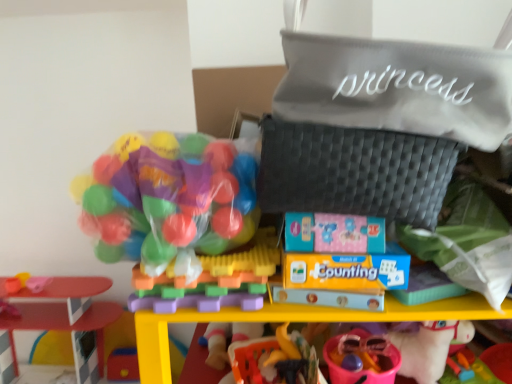
What do you see at coordinates (212, 281) in the screenshot?
I see `translucent plastic balls at center, the 3th toy positioned from the left` at bounding box center [212, 281].

Where is `translucent plastic balls at center, acting as the third toy starting from the right`? This screenshot has width=512, height=384. translucent plastic balls at center, acting as the third toy starting from the right is located at coordinates (212, 281).

What do you see at coordinates (168, 201) in the screenshot?
I see `translucent plastic balls at upper left, which ranks as the 2th toy in left-to-right order` at bounding box center [168, 201].

Where is `rubber duck at lower center, which appears as the second toy when viewed from the right`? The image size is (512, 384). rubber duck at lower center, which appears as the second toy when viewed from the right is located at coordinates (272, 358).

Looking at this image, does translucent plastic balls at upper left, which ranks as the 2th toy in left-to-right order, have a greater height compared to smooth plastic table at left, acting as the fifth toy starting from the right?

No.

The height and width of the screenshot is (384, 512). I want to click on the 4th toy positioned above the smooth plastic table at left, which is counted as the first toy, starting from the left (from the image's perspective), so 168,201.

Is the depth of translucent plastic balls at upper left, which ranks as the 2th toy in left-to-right order, less than that of smooth plastic table at left, acting as the fifth toy starting from the right?

Yes, the depth of translucent plastic balls at upper left, which ranks as the 2th toy in left-to-right order, is less than that of smooth plastic table at left, acting as the fifth toy starting from the right.

Is translucent plastic balls at upper left, which ranks as the 2th toy in left-to-right order, far away from smooth plastic table at left, which is counted as the first toy, starting from the left?

translucent plastic balls at upper left, which ranks as the 2th toy in left-to-right order, is far away from smooth plastic table at left, which is counted as the first toy, starting from the left.

Is smooth plastic table at left, which is counted as the first toy, starting from the left, placed right next to rubber duck at lower center, which appears as the second toy when viewed from the right?

smooth plastic table at left, which is counted as the first toy, starting from the left, is not next to rubber duck at lower center, which appears as the second toy when viewed from the right, and they're not touching.

Is smooth plastic table at left, acting as the fifth toy starting from the right, shorter than rubber duck at lower center, which appears as the second toy when viewed from the right?

No, smooth plastic table at left, acting as the fifth toy starting from the right, is not shorter than rubber duck at lower center, which appears as the second toy when viewed from the right.

The height and width of the screenshot is (384, 512). Identify the location of toy below the rubber duck at lower center, acting as the 4th toy starting from the left (from a real-world perspective). pyautogui.click(x=61, y=322).

Is translucent plastic balls at center, the 3th toy positioned from the left, oriented towards smooth plastic table at left, acting as the fifth toy starting from the right?

No, translucent plastic balls at center, the 3th toy positioned from the left, is not aimed at smooth plastic table at left, acting as the fifth toy starting from the right.

Find the location of a particular element. Image resolution: width=512 pixels, height=384 pixels. the 3rd toy positioned below the translucent plastic balls at center, acting as the third toy starting from the right (from a real-world perspective) is located at coordinates (61, 322).

From the image's perspective, is translucent plastic balls at center, acting as the third toy starting from the right, under smooth plastic table at left, which is counted as the first toy, starting from the left?

No, from the image's perspective, translucent plastic balls at center, acting as the third toy starting from the right, is not beneath smooth plastic table at left, which is counted as the first toy, starting from the left.

Is translucent plastic balls at center, acting as the third toy starting from the right, further to the viewer compared to smooth plastic table at left, acting as the fifth toy starting from the right?

No, translucent plastic balls at center, acting as the third toy starting from the right, is closer to the viewer.

Is pink plastic bucket at lower center, the 1th toy viewed from the right, behind smooth plastic table at left, which is counted as the first toy, starting from the left?

No, pink plastic bucket at lower center, the 1th toy viewed from the right, is in front of smooth plastic table at left, which is counted as the first toy, starting from the left.

Who is shorter, pink plastic bucket at lower center, the 1th toy viewed from the right, or smooth plastic table at left, which is counted as the first toy, starting from the left?

pink plastic bucket at lower center, the 1th toy viewed from the right, is shorter.

Is pink plastic bucket at lower center, the 1th toy viewed from the right, looking in the opposite direction of smooth plastic table at left, which is counted as the first toy, starting from the left?

pink plastic bucket at lower center, the 1th toy viewed from the right, does not have its back to smooth plastic table at left, which is counted as the first toy, starting from the left.

Considering the sizes of objects pink plastic bucket at lower center, the 5th toy viewed from the left, and smooth plastic table at left, which is counted as the first toy, starting from the left, in the image provided, who is thinner, pink plastic bucket at lower center, the 5th toy viewed from the left, or smooth plastic table at left, which is counted as the first toy, starting from the left,?

With smaller width is pink plastic bucket at lower center, the 5th toy viewed from the left.

How different are the orientations of translucent plastic balls at center, the 3th toy positioned from the left, and pink plastic bucket at lower center, the 1th toy viewed from the right, in degrees?

0.00245 degrees.

This screenshot has height=384, width=512. I want to click on the 1st toy positioned below the translucent plastic balls at center, acting as the third toy starting from the right (from a real-world perspective), so click(x=362, y=360).

Is translucent plastic balls at center, the 3th toy positioned from the left, positioned with its back to pink plastic bucket at lower center, the 5th toy viewed from the left?

No, translucent plastic balls at center, the 3th toy positioned from the left,'s orientation is not away from pink plastic bucket at lower center, the 5th toy viewed from the left.

Is translucent plastic balls at center, acting as the third toy starting from the right, to the left of pink plastic bucket at lower center, the 5th toy viewed from the left, from the viewer's perspective?

Yes.

Relative to translucent plastic balls at center, acting as the third toy starting from the right, is rubber duck at lower center, acting as the 4th toy starting from the left, in front or behind?

Clearly, rubber duck at lower center, acting as the 4th toy starting from the left, is behind translucent plastic balls at center, acting as the third toy starting from the right.

Which point is more distant from viewer, (257, 349) or (188, 296)?

Positioned behind is point (257, 349).

Is rubber duck at lower center, which appears as the second toy when viewed from the right, next to translucent plastic balls at center, acting as the third toy starting from the right?

rubber duck at lower center, which appears as the second toy when viewed from the right, is not next to translucent plastic balls at center, acting as the third toy starting from the right, and they're not touching.

Can you confirm if rubber duck at lower center, acting as the 4th toy starting from the left, is shorter than translucent plastic balls at center, the 3th toy positioned from the left?

Incorrect, the height of rubber duck at lower center, acting as the 4th toy starting from the left, does not fall short of that of translucent plastic balls at center, the 3th toy positioned from the left.

Considering the relative sizes of translucent plastic balls at upper left, which is the 4th toy in right-to-left order, and translucent plastic balls at center, acting as the third toy starting from the right, in the image provided, is translucent plastic balls at upper left, which is the 4th toy in right-to-left order, bigger than translucent plastic balls at center, acting as the third toy starting from the right,?

Yes, translucent plastic balls at upper left, which is the 4th toy in right-to-left order, is bigger than translucent plastic balls at center, acting as the third toy starting from the right.

Is translucent plastic balls at upper left, which is the 4th toy in right-to-left order, spatially inside translucent plastic balls at center, acting as the third toy starting from the right, or outside of it?

translucent plastic balls at upper left, which is the 4th toy in right-to-left order, lies outside translucent plastic balls at center, acting as the third toy starting from the right.

Which of these two, translucent plastic balls at upper left, which is the 4th toy in right-to-left order, or translucent plastic balls at center, acting as the third toy starting from the right, is thinner?

translucent plastic balls at upper left, which is the 4th toy in right-to-left order.

Is there a large distance between translucent plastic balls at upper left, which is the 4th toy in right-to-left order, and translucent plastic balls at center, the 3th toy positioned from the left?

They are positioned close to each other.

This screenshot has height=384, width=512. Find the location of `toy that is the 4th object above the smooth plastic table at left, acting as the fifth toy starting from the right (from a real-world perspective)`. toy that is the 4th object above the smooth plastic table at left, acting as the fifth toy starting from the right (from a real-world perspective) is located at coordinates (168, 201).

From the rubber duck at lower center, acting as the 4th toy starting from the left, count the 3rd toy to the left and point to it. Please provide its 2D coordinates.

[(61, 322)]

Considering their positions, is rubber duck at lower center, which appears as the second toy when viewed from the right, positioned further to translucent plastic balls at upper left, which ranks as the 2th toy in left-to-right order, than pink plastic bucket at lower center, the 1th toy viewed from the right?

Among the two, pink plastic bucket at lower center, the 1th toy viewed from the right, is located further to translucent plastic balls at upper left, which ranks as the 2th toy in left-to-right order.

Which object lies nearer to the anchor point smooth plastic table at left, acting as the fifth toy starting from the right, pink plastic bucket at lower center, the 5th toy viewed from the left, or rubber duck at lower center, which appears as the second toy when viewed from the right?

rubber duck at lower center, which appears as the second toy when viewed from the right.

Considering their positions, is smooth plastic table at left, which is counted as the first toy, starting from the left, positioned closer to translucent plastic balls at center, the 3th toy positioned from the left, than rubber duck at lower center, acting as the 4th toy starting from the left?

The object closer to translucent plastic balls at center, the 3th toy positioned from the left, is rubber duck at lower center, acting as the 4th toy starting from the left.

From the image, which object appears to be nearer to translucent plastic balls at upper left, which is the 4th toy in right-to-left order, pink plastic bucket at lower center, the 5th toy viewed from the left, or smooth plastic table at left, which is counted as the first toy, starting from the left?

Based on the image, pink plastic bucket at lower center, the 5th toy viewed from the left, appears to be nearer to translucent plastic balls at upper left, which is the 4th toy in right-to-left order.

Looking at the image, which one is located closer to smooth plastic table at left, which is counted as the first toy, starting from the left, translucent plastic balls at center, the 3th toy positioned from the left, or rubber duck at lower center, acting as the 4th toy starting from the left?

rubber duck at lower center, acting as the 4th toy starting from the left, is closer to smooth plastic table at left, which is counted as the first toy, starting from the left.

When comparing their distances from pink plastic bucket at lower center, the 1th toy viewed from the right, does translucent plastic balls at upper left, which is the 4th toy in right-to-left order, or rubber duck at lower center, acting as the 4th toy starting from the left, seem closer?

Based on the image, rubber duck at lower center, acting as the 4th toy starting from the left, appears to be nearer to pink plastic bucket at lower center, the 1th toy viewed from the right.

When comparing their distances from translucent plastic balls at center, acting as the third toy starting from the right, does translucent plastic balls at upper left, which is the 4th toy in right-to-left order, or pink plastic bucket at lower center, the 5th toy viewed from the left, seem closer?

Based on the image, translucent plastic balls at upper left, which is the 4th toy in right-to-left order, appears to be nearer to translucent plastic balls at center, acting as the third toy starting from the right.

Estimate the real-world distances between objects in this image. Which object is closer to pink plastic bucket at lower center, the 5th toy viewed from the left, translucent plastic balls at upper left, which is the 4th toy in right-to-left order, or smooth plastic table at left, which is counted as the first toy, starting from the left?

translucent plastic balls at upper left, which is the 4th toy in right-to-left order, lies closer to pink plastic bucket at lower center, the 5th toy viewed from the left, than the other object.

You are a GUI agent. You are given a task and a screenshot of the screen. Output one action in this format:
    pyautogui.click(x=<x>, y=<y>)
    Task: Click on the toy between translucent plastic balls at center, acting as the third toy starting from the right, and pink plastic bucket at lower center, the 1th toy viewed from the right, in the horizontal direction
    This screenshot has width=512, height=384.
    Given the screenshot: What is the action you would take?
    pyautogui.click(x=272, y=358)